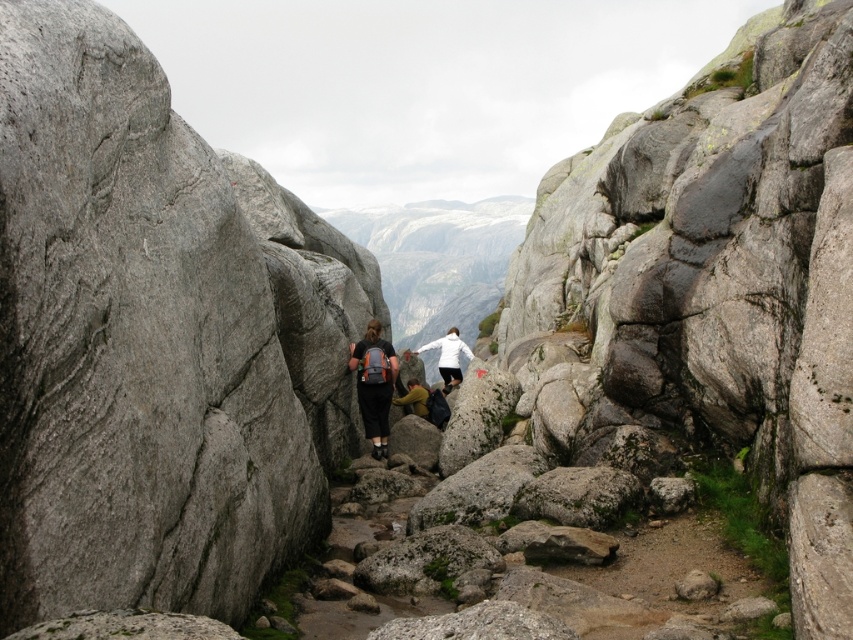
You are a hiker on the mountain path and need to determine the order of the hikers. Which object is closer to you between the matte black backpack at center and the white matte jacket at center?

The matte black backpack at center is closer to you because it is in front of the white matte jacket at center.

You are a hiker standing at the starting point of the rugged, rocky path in the mountainous landscape. You see a matte black backpack at center. Can you confirm if the backpack is positioned exactly at the coordinates point (x=374, y=387)?

The matte black backpack at center is located at point (x=374, y=387), so yes, the backpack is exactly at those coordinates.